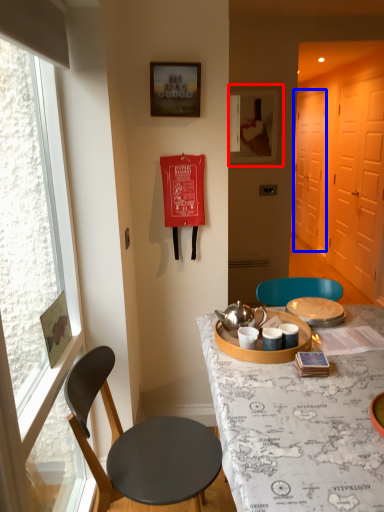
Question: Among these objects, which one is nearest to the camera, picture frame (highlighted by a red box) or screen door (highlighted by a blue box)?

Choices:
 (A) picture frame
 (B) screen door

Answer: (A)